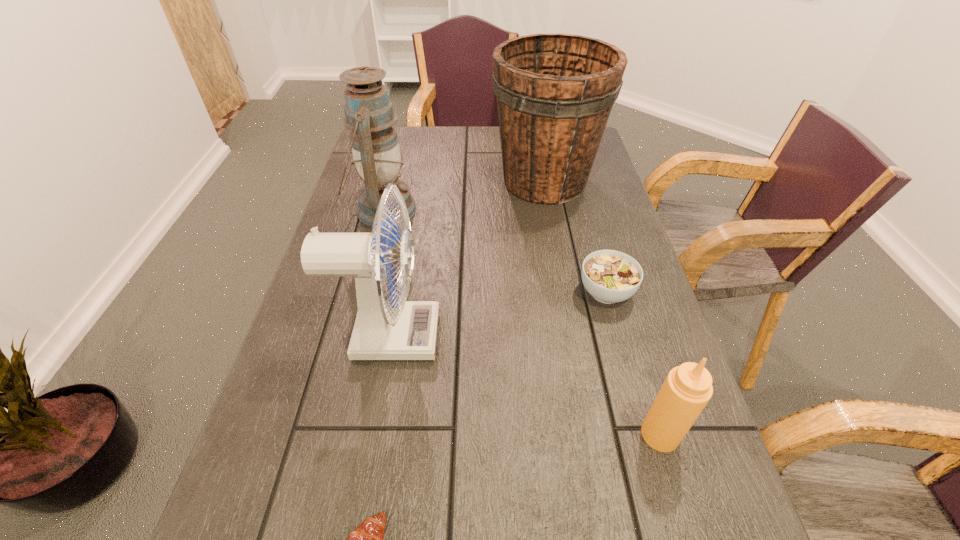
Find the location of a particular element. blank area in the image that satisfies the following two spatial constraints: 1. on the front-facing side of the third shortest object; 2. on the right side of the fan is located at coordinates (370, 434).

Find the location of a particular element. The height and width of the screenshot is (540, 960). free space that satisfies the following two spatial constraints: 1. on the front side of the condiment; 2. on the left side of the bucket is located at coordinates (591, 434).